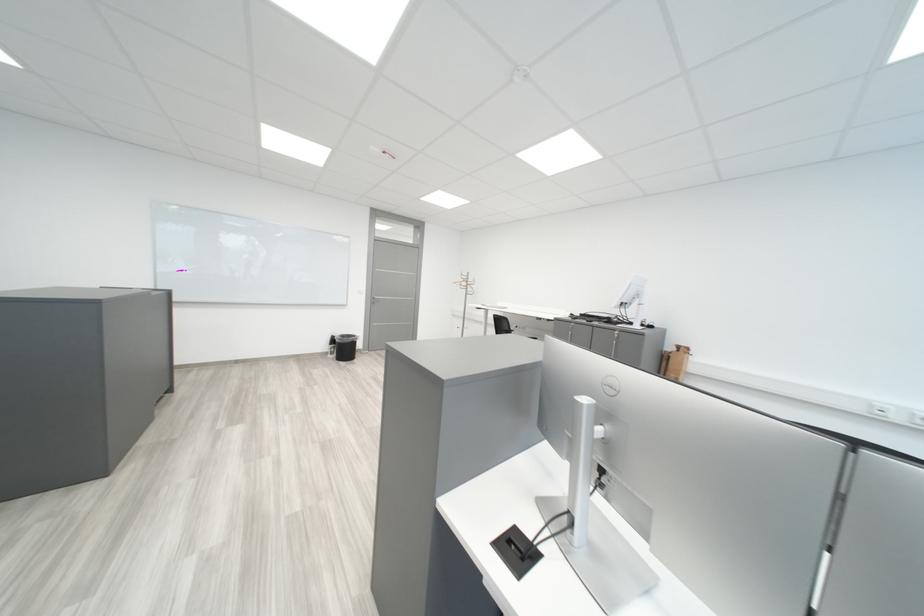
Describe the element at coordinates (379, 296) in the screenshot. I see `the grey door handle` at that location.